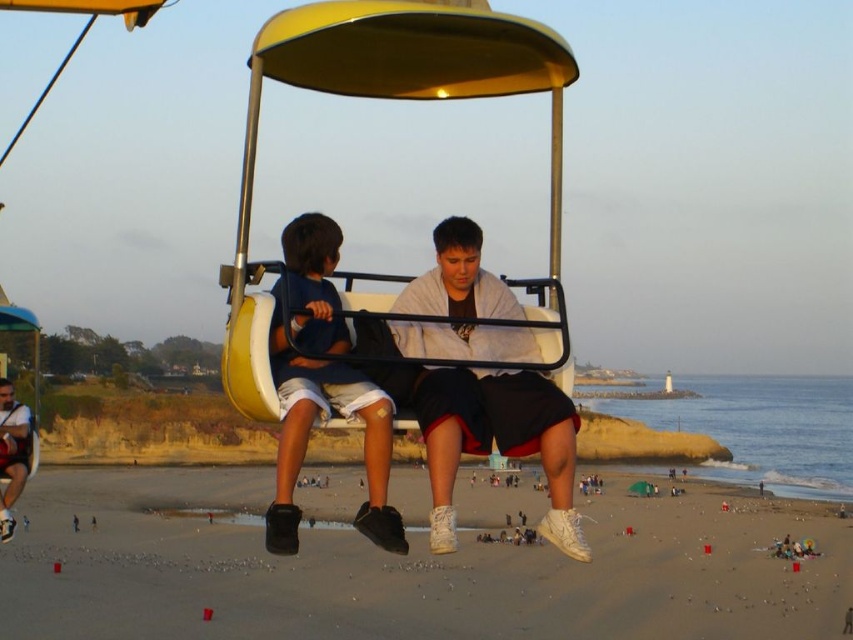
You are standing at the point labeled point (300, 86) and want to take a photo of the beach scene. The camera you are using has a maximum range of 30 meters. Can you capture the entire scene from your current position?

The point labeled point (300, 86) and the camera are 33.19 meters apart. Since the camera has a maximum range of 30 meters, you cannot capture the entire scene from your current position because the distance exceeds the camera range.

You are standing on the sandy beach at lower center and want to reach the matte black shorts at center. Which direction should you move to get closer?

You should move upward to reach the matte black shorts at center since the sandy beach at lower center is below it.